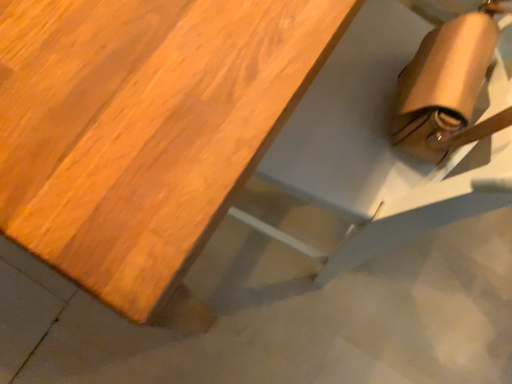
Question: From their relative heights in the image, would you say wooden table at upper left is taller or shorter than matte brown bag at lower right?

Choices:
 (A) short
 (B) tall

Answer: (A)

Question: From a real-world perspective, is wooden table at upper left physically located above or below matte brown bag at lower right?

Choices:
 (A) above
 (B) below

Answer: (B)

Question: Based on their positions, is wooden table at upper left located to the left or right of matte brown bag at lower right?

Choices:
 (A) right
 (B) left

Answer: (B)

Question: In terms of size, does matte brown bag at lower right appear bigger or smaller than wooden table at upper left?

Choices:
 (A) big
 (B) small

Answer: (B)

Question: Considering their positions, is matte brown bag at lower right located in front of or behind wooden table at upper left?

Choices:
 (A) front
 (B) behind

Answer: (B)

Question: From the image's perspective, is matte brown bag at lower right above or below wooden table at upper left?

Choices:
 (A) above
 (B) below

Answer: (B)

Question: In terms of width, does matte brown bag at lower right look wider or thinner when compared to wooden table at upper left?

Choices:
 (A) thin
 (B) wide

Answer: (A)